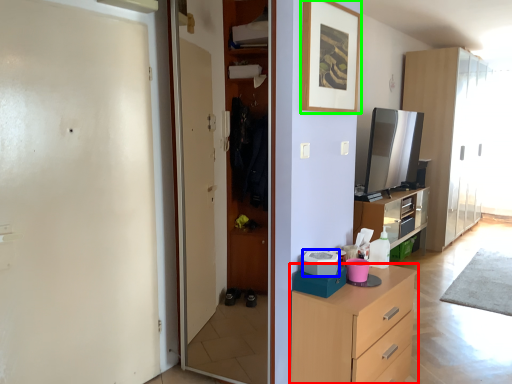
Question: Which object is positioned farthest from chest of drawers (highlighted by a red box)? Select from appliance (highlighted by a blue box) and picture frame (highlighted by a green box).

Choices:
 (A) appliance
 (B) picture frame

Answer: (B)